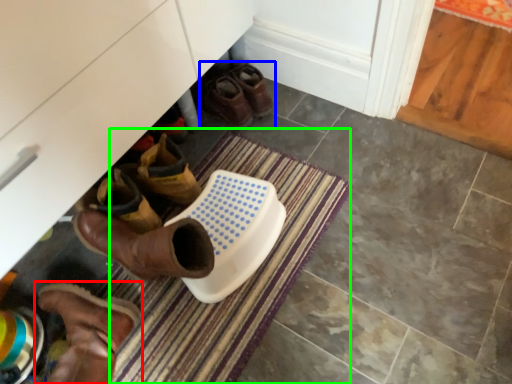
Question: Which object is positioned farthest from footwear (highlighted by a red box)? Select from footwear (highlighted by a blue box) and bath mat (highlighted by a green box).

Choices:
 (A) footwear
 (B) bath mat

Answer: (A)